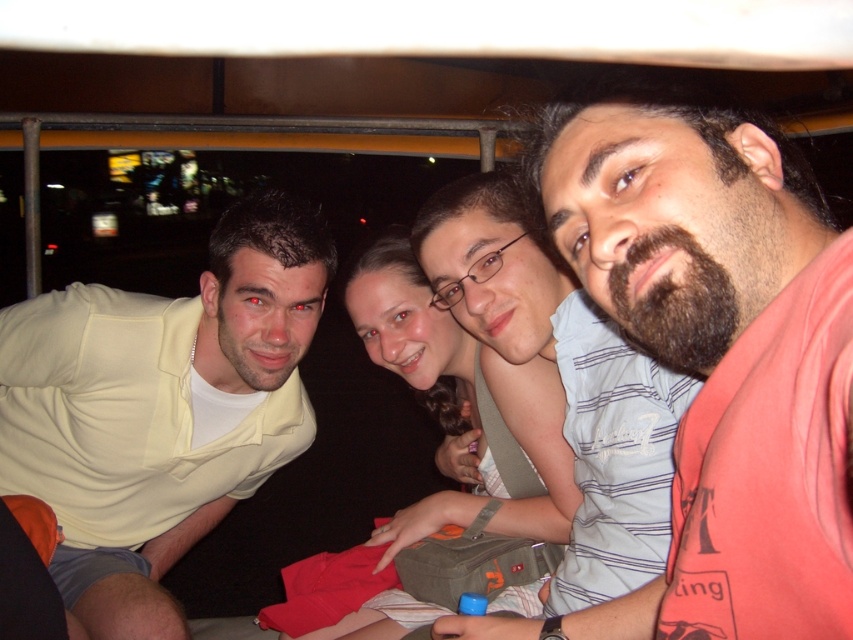
Question: Can you confirm if light yellow shirt at left is wider than smooth beige shirt at center?

Choices:
 (A) no
 (B) yes

Answer: (B)

Question: Can you confirm if light yellow shirt at left is smaller than smooth beige shirt at center?

Choices:
 (A) yes
 (B) no

Answer: (B)

Question: Which object is the closest to the light yellow shirt at left?

Choices:
 (A) smooth beige shirt at center
 (B) bearded man at center

Answer: (A)

Question: Is bearded man at center wider than light yellow shirt at left?

Choices:
 (A) no
 (B) yes

Answer: (A)

Question: Estimate the real-world distances between objects in this image. Which object is closer to the bearded man at center?

Choices:
 (A) smooth beige shirt at center
 (B) light yellow shirt at left

Answer: (A)

Question: Based on their relative distances, which object is nearer to the smooth beige shirt at center?

Choices:
 (A) bearded man at center
 (B) light yellow shirt at left

Answer: (B)